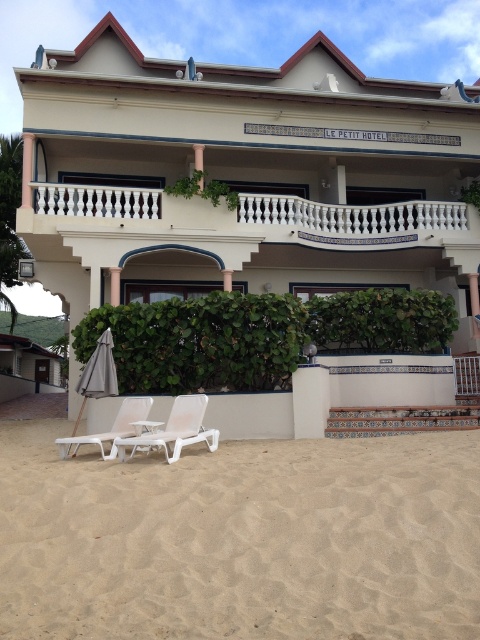
Question: Which object is closer to the camera taking this photo?

Choices:
 (A) white plastic chair at lower left
 (B) white balustrade at upper center
 (C) white plastic beach chair at lower center

Answer: (C)

Question: Which point is farther from the camera taking this photo?

Choices:
 (A) (115, 381)
 (B) (225, 218)
 (C) (208, 531)
 (D) (295, 177)

Answer: (D)

Question: Among these objects, which one is nearest to the camera?

Choices:
 (A) gray fabric umbrella at lower left
 (B) beige sandy beach at lower center

Answer: (B)

Question: Does white balustrade at upper center have a lesser width compared to white plastic beach chair at lower center?

Choices:
 (A) yes
 (B) no

Answer: (B)

Question: Is white matte building at center above white plastic chair at lower left?

Choices:
 (A) no
 (B) yes

Answer: (B)

Question: Does white matte building at center appear under beige sandy beach at lower center?

Choices:
 (A) yes
 (B) no

Answer: (B)